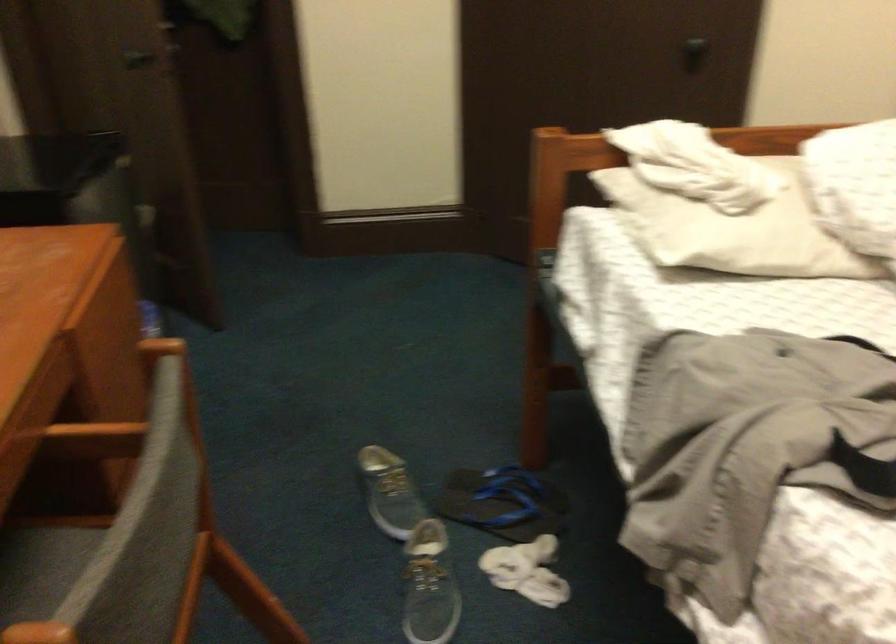
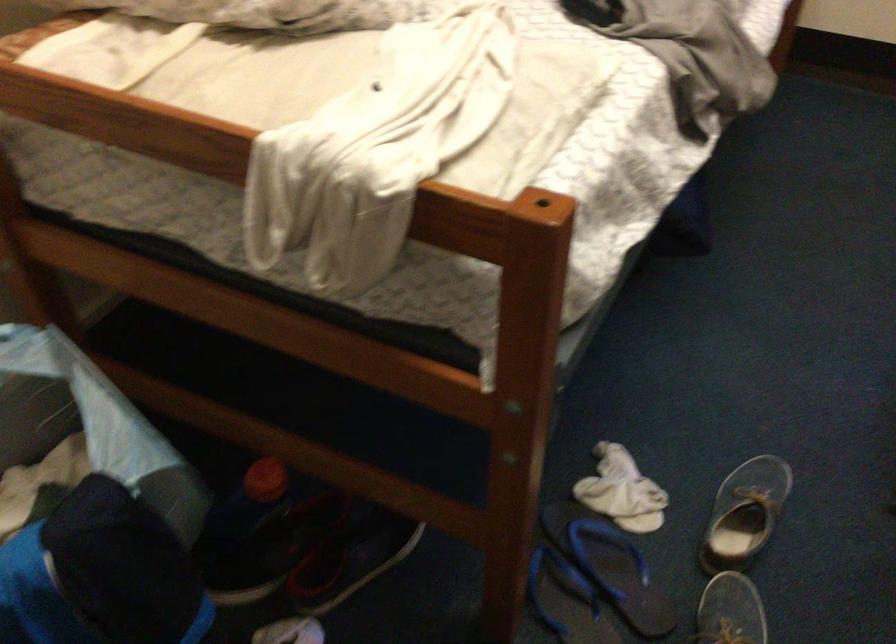
In the second image, find the point that corresponds to [518,565] in the first image.

(622, 491)